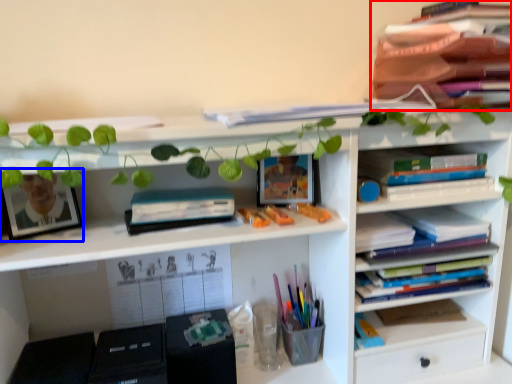
Question: Which of the following is the farthest to the observer, book (highlighted by a red box) or picture frame (highlighted by a blue box)?

Choices:
 (A) book
 (B) picture frame

Answer: (B)